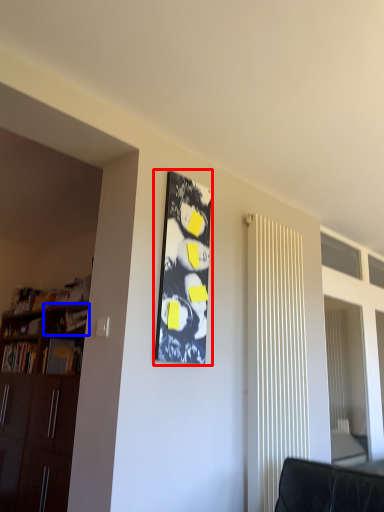
Question: Among these objects, which one is nearest to the camera, bulletin board (highlighted by a red box) or shelf (highlighted by a blue box)?

Choices:
 (A) bulletin board
 (B) shelf

Answer: (A)